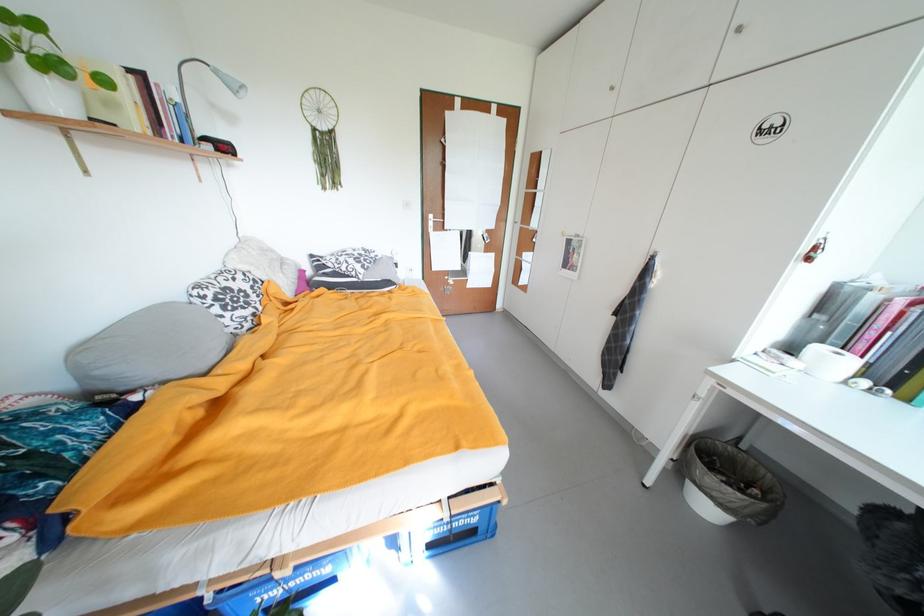
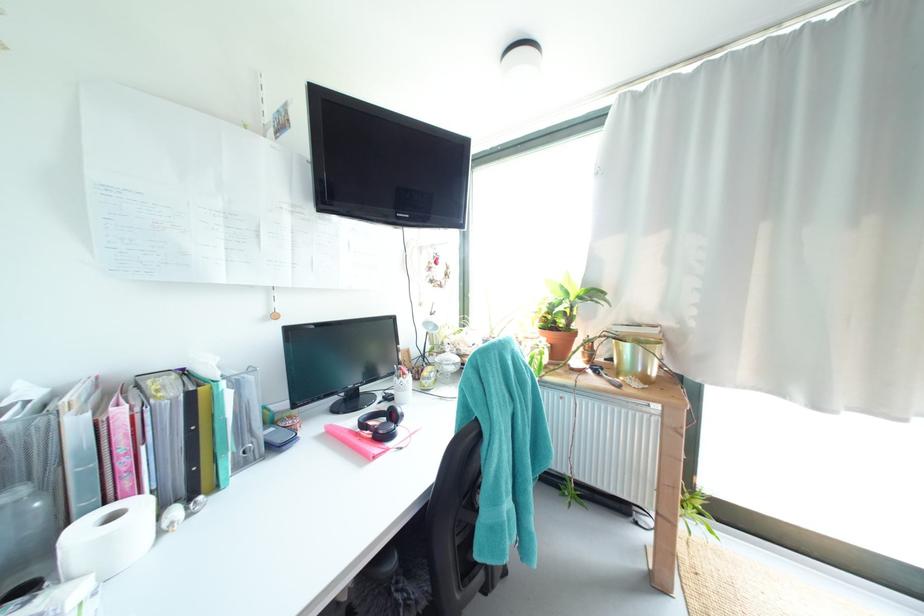
The point at [873,384] is marked in the first image. Where is the corresponding point in the second image?

(185, 513)